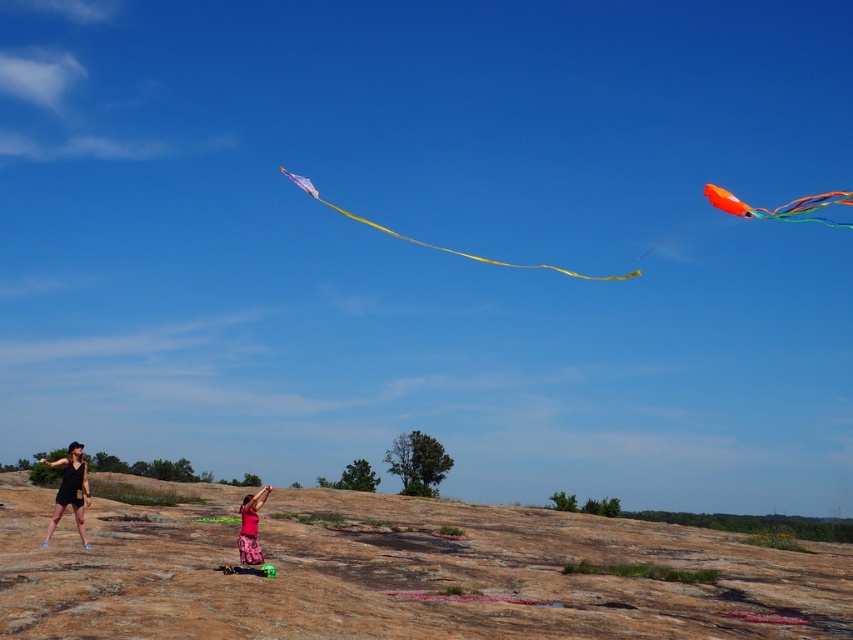
Question: Estimate the real-world distances between objects in this image. Which object is farther from the brown rock at lower center?

Choices:
 (A) translucent purple kite at center
 (B) matte black shorts at lower left

Answer: (A)

Question: Can you confirm if brown rock at lower center is bigger than matte pink skirt at center?

Choices:
 (A) no
 (B) yes

Answer: (B)

Question: Does brown rock at lower center have a greater width compared to translucent purple kite at center?

Choices:
 (A) no
 (B) yes

Answer: (B)

Question: Which object is the farthest from the matte black shorts at lower left?

Choices:
 (A) matte pink skirt at center
 (B) brown rock at lower center

Answer: (B)

Question: Estimate the real-world distances between objects in this image. Which object is closer to the translucent purple kite at center?

Choices:
 (A) brown rock at lower center
 (B) orange glossy kite at upper right
 (C) matte pink skirt at center

Answer: (A)

Question: Is orange glossy kite at upper right wider than matte pink skirt at center?

Choices:
 (A) yes
 (B) no

Answer: (A)